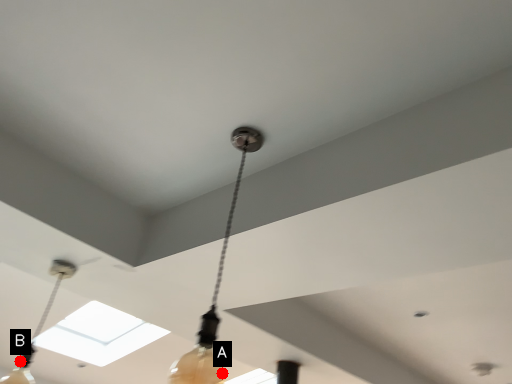
Question: Two points are circled on the image, labeled by A and B beside each circle. Among these points, which one is farthest from the camera?

Choices:
 (A) A is further
 (B) B is further

Answer: (B)